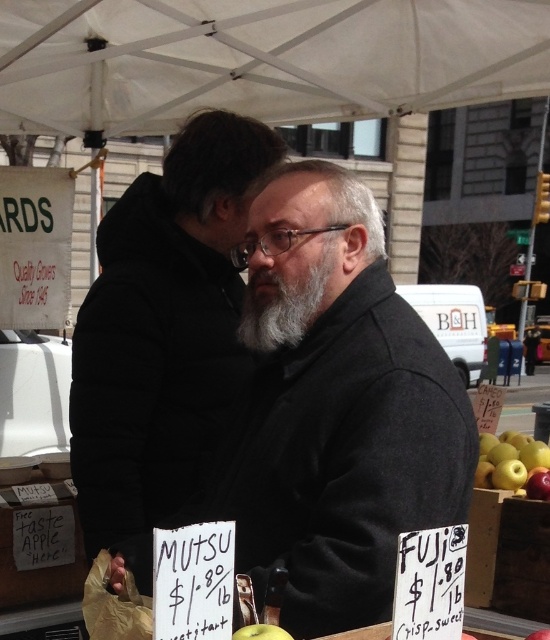
You are standing at the market and want to reach both points in the image. Which point, point (101, 481) or point (266, 628), will you reach first if you move straight toward them?

You will reach point (101, 481) first because it is closer to you than point (266, 628), which is further away.

You are a customer at the market and want to compare the sizes of the items you see. Which one is bigger between the dark gray wool coat at center and the green matte apple at lower center?

The dark gray wool coat at center has a larger size compared to the green matte apple at lower center, so the dark gray wool coat at center is bigger.

You are a customer at the market and want to ask the man with the gray matte beard at center about the apples. Can you see his face clearly from your position in front of the white fabric canopy at upper center?

The gray matte beard at center is behind the white fabric canopy at upper center, so you cannot see his face clearly from in front of the white fabric canopy at upper center.